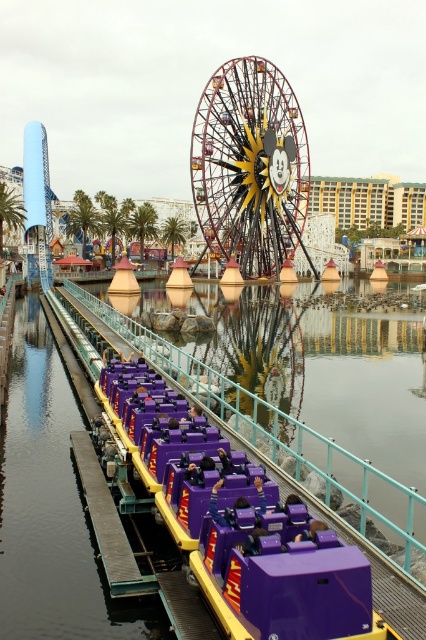
You are standing at the entrance of the theme park and want to find the smooth gray dock at lower left. According to the map coordinates, where should you look to find it?

The smooth gray dock at lower left is located at coordinates point (108, 524).

You are standing at the camera position and want to reach the point at coordinates point [213,154]. If you walk straight towards it, how far will you have to walk?

The distance between the point [213,154] and the camera is 145.13 meters, so you will have to walk 145.13 meters straight towards it.